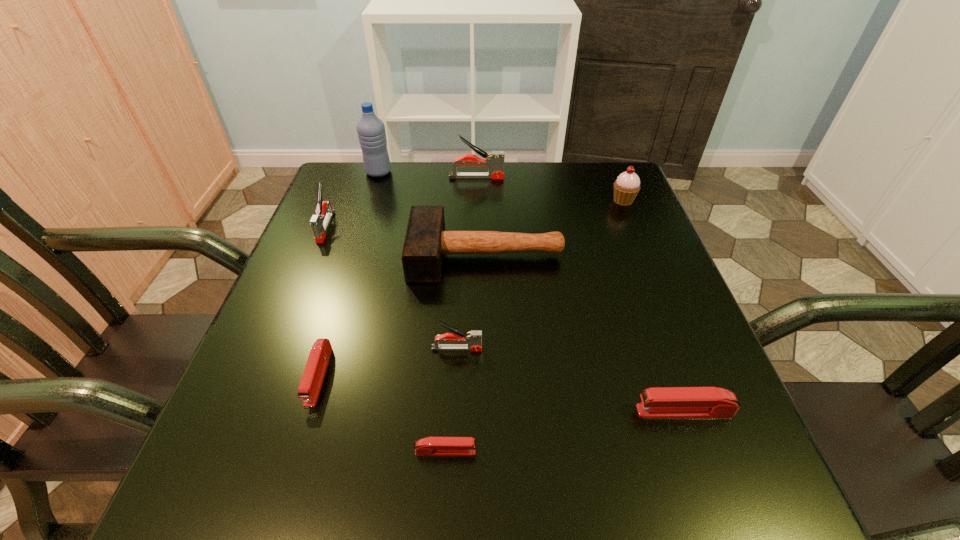
Find the location of `the second closest red stapler to the leftmost stapler`. the second closest red stapler to the leftmost stapler is located at coordinates (431, 446).

Where is `blank area in the image that satisfies the following two spatial constraints: 1. on the hammer head face of the mallet; 2. on the front-facing side of the second stapler from left to right`? The height and width of the screenshot is (540, 960). blank area in the image that satisfies the following two spatial constraints: 1. on the hammer head face of the mallet; 2. on the front-facing side of the second stapler from left to right is located at coordinates (488, 375).